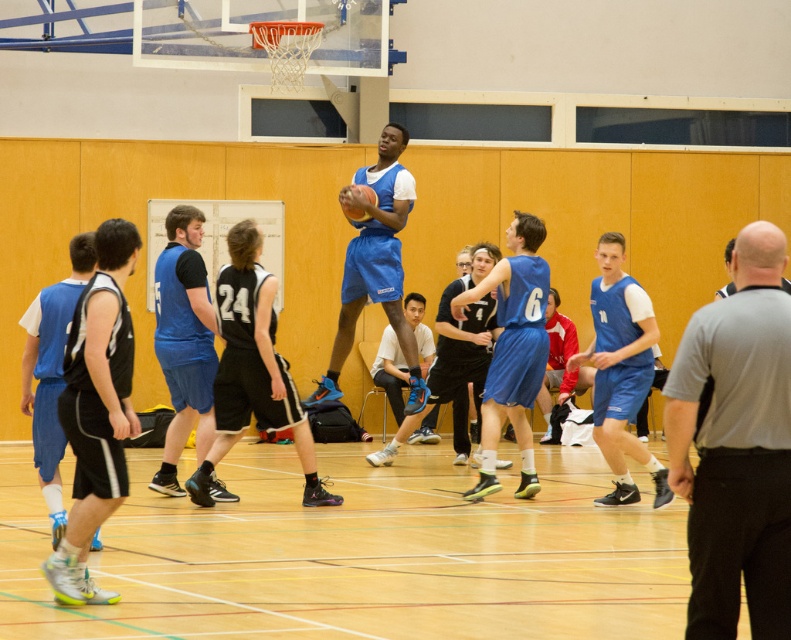
Is matte blue shorts at center below glossy blue basketball at center?

Yes, matte blue shorts at center is below glossy blue basketball at center.

Between point (222, 499) and point (362, 195), which one is positioned in front?

Point (362, 195) is in front.

Where is `matte blue shorts at center`? The height and width of the screenshot is (640, 791). matte blue shorts at center is located at coordinates coord(184,340).

Between point (634, 397) and point (36, 324), which one is positioned behind?

The point (634, 397) is behind.

Does matte blue jersey at right come behind matte blue shorts at left?

Yes, it is behind matte blue shorts at left.

Is point (646, 316) farther from viewer compared to point (69, 244)?

Yes, it is behind point (69, 244).

Image resolution: width=791 pixels, height=640 pixels. What are the coordinates of `matte blue jersey at right` in the screenshot? It's located at (619, 371).

Does point (596, 316) lie in front of point (424, 396)?

Yes.

Can you confirm if matte blue jersey at right is taller than matte blue basketball at center?

In fact, matte blue jersey at right may be shorter than matte blue basketball at center.

Describe the element at coordinates (619, 371) in the screenshot. This screenshot has height=640, width=791. I see `matte blue jersey at right` at that location.

You are a GUI agent. You are given a task and a screenshot of the screen. Output one action in this format:
    pyautogui.click(x=<x>, y=<y>)
    Task: Click on the matte blue jersey at right
    
    Given the screenshot: What is the action you would take?
    pyautogui.click(x=619, y=371)